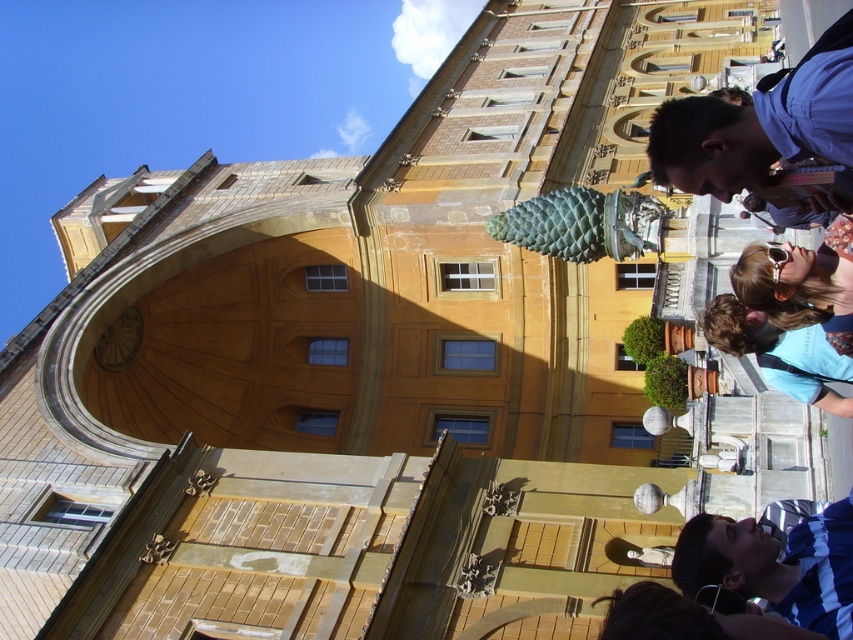
You are standing in front of a historical building and see a person in a blue striped shirt at lower right and another wearing matte gold sunglasses at upper right. Which of these two items is larger?

The blue striped shirt at lower right is bigger than the matte gold sunglasses at upper right.

You are standing in front of the grand historical building and want to walk towards the point marked as point (x=738, y=528). However, there is an obstacle at point (x=801, y=296). Will you encounter the obstacle before reaching your destination?

Point (x=738, y=528) is in front of point (x=801, y=296), so you will reach your destination before encountering the obstacle.